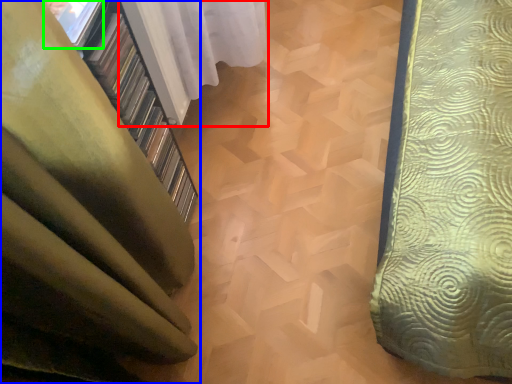
Question: Which object is the closest to the curtain (highlighted by a red box)? Choose among these: curtain (highlighted by a blue box) or window (highlighted by a green box).

Choices:
 (A) curtain
 (B) window

Answer: (B)